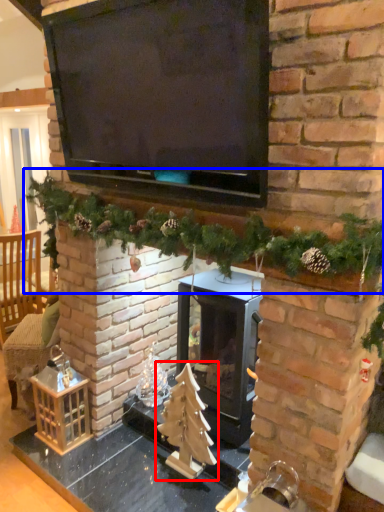
Question: Which point is further to the camera, christmas tree (highlighted by a red box) or christmas decoration (highlighted by a blue box)?

Choices:
 (A) christmas tree
 (B) christmas decoration

Answer: (A)